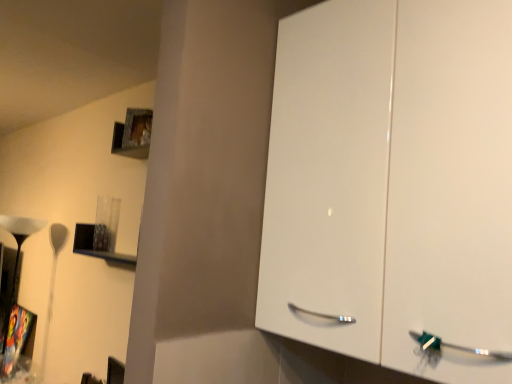
Question: Can you see matte black lampshade at left touching metallic silver shelf at upper left?

Choices:
 (A) yes
 (B) no

Answer: (B)

Question: From a real-world perspective, is matte black lampshade at left under metallic silver shelf at upper left?

Choices:
 (A) yes
 (B) no

Answer: (A)

Question: Does matte black lampshade at left come behind metallic silver shelf at upper left?

Choices:
 (A) yes
 (B) no

Answer: (A)

Question: Does matte black lampshade at left have a greater width compared to metallic silver shelf at upper left?

Choices:
 (A) yes
 (B) no

Answer: (A)

Question: From a real-world perspective, is matte black lampshade at left positioned over metallic silver shelf at upper left based on gravity?

Choices:
 (A) no
 (B) yes

Answer: (A)

Question: Does matte black lampshade at left appear on the right side of metallic silver shelf at upper left?

Choices:
 (A) yes
 (B) no

Answer: (B)

Question: Can you confirm if metallic silver shelf at upper left is bigger than matte black lampshade at left?

Choices:
 (A) yes
 (B) no

Answer: (B)

Question: From a real-world perspective, is metallic silver shelf at upper left positioned over matte black lampshade at left based on gravity?

Choices:
 (A) yes
 (B) no

Answer: (A)

Question: Can matte black lampshade at left be found inside metallic silver shelf at upper left?

Choices:
 (A) yes
 (B) no

Answer: (B)

Question: Can you confirm if metallic silver shelf at upper left is taller than matte black lampshade at left?

Choices:
 (A) no
 (B) yes

Answer: (A)

Question: From the image's perspective, is metallic silver shelf at upper left above matte black lampshade at left?

Choices:
 (A) no
 (B) yes

Answer: (B)

Question: Is metallic silver shelf at upper left looking in the opposite direction of matte black lampshade at left?

Choices:
 (A) no
 (B) yes

Answer: (A)

Question: From their relative heights in the image, would you say matte black lampshade at left is taller or shorter than metallic silver shelf at upper left?

Choices:
 (A) tall
 (B) short

Answer: (A)